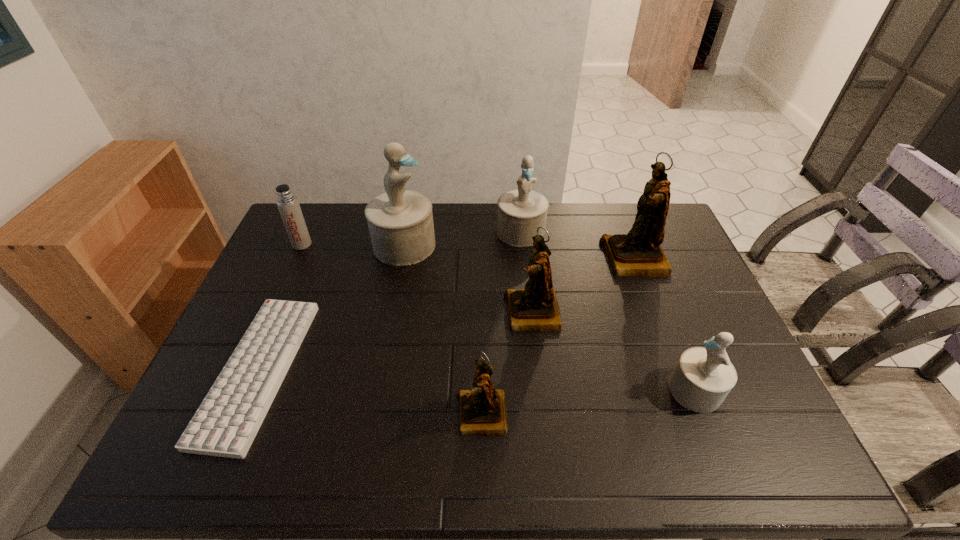
Choose which object is the seventh nearest neighbor to the rightmost gold figurine. Please provide its 2D coordinates. Your answer should be formatted as a tuple, i.e. [(x, y)], where the tuple contains the x and y coordinates of a point satisfying the conditions above.

[(287, 203)]

Locate which object is the fifth closest to the second biggest white figurine. Please provide its 2D coordinates. Your answer should be formatted as a tuple, i.e. [(x, y)], where the tuple contains the x and y coordinates of a point satisfying the conditions above.

[(483, 412)]

At what (x,y) coordinates should I click in order to perform the action: click on figurine object that ranks as the closest to the leftmost figurine. Please return your answer as a coordinate pair (x, y). Looking at the image, I should click on (521, 211).

Find the location of a particular element. The height and width of the screenshot is (540, 960). figurine that is the second closest to the second biggest white figurine is located at coordinates (535, 308).

Locate which white figurine is the closest to the second smallest gold figurine. Please provide its 2D coordinates. Your answer should be formatted as a tuple, i.e. [(x, y)], where the tuple contains the x and y coordinates of a point satisfying the conditions above.

[(521, 211)]

Locate an element on the screen. Image resolution: width=960 pixels, height=540 pixels. the closest white figurine relative to the thermos bottle is located at coordinates (400, 222).

Select which gold figurine is the second closest to the sixth object from right to left. Please provide its 2D coordinates. Your answer should be formatted as a tuple, i.e. [(x, y)], where the tuple contains the x and y coordinates of a point satisfying the conditions above.

[(483, 412)]

Image resolution: width=960 pixels, height=540 pixels. Identify the location of the closest gold figurine to the leftmost gold figurine. pyautogui.click(x=535, y=308).

You are a GUI agent. You are given a task and a screenshot of the screen. Output one action in this format:
    pyautogui.click(x=<x>, y=<y>)
    Task: Click on the free spot that satisfies the following two spatial constraints: 1. on the front-facing side of the biggest gold figurine; 2. on the front side of the computer keyboard
    Image resolution: width=960 pixels, height=540 pixels.
    Given the screenshot: What is the action you would take?
    (x=677, y=370)